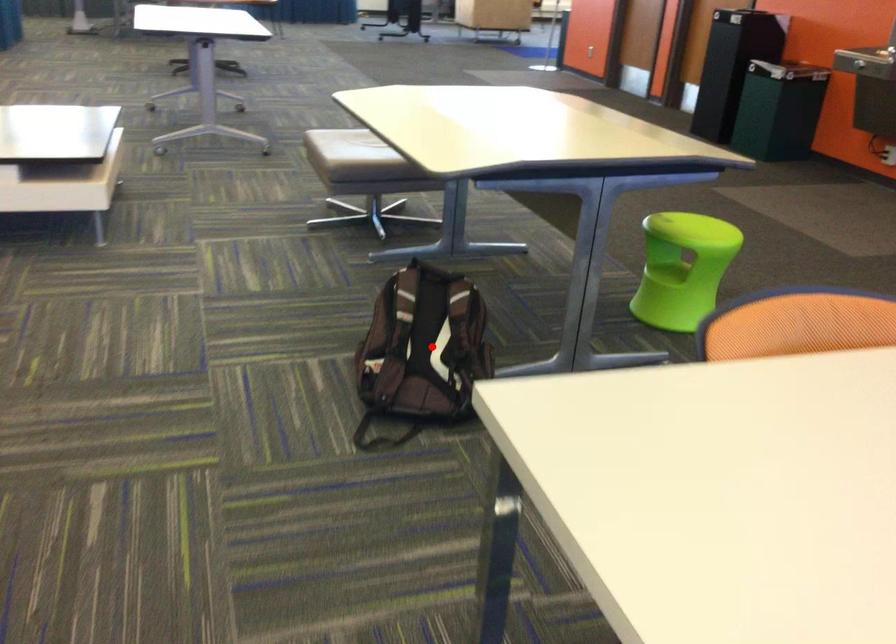
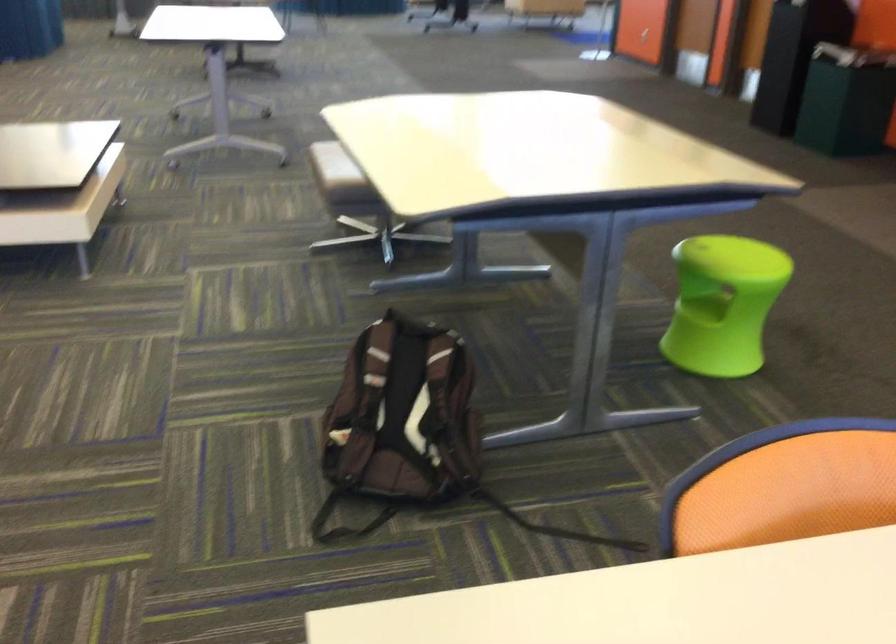
Question: I am providing you with two images of the same scene from different viewpoints. A red point is marked on the first image. At the location where the point appears in image 1, is it still visible in image 2?

Choices:
 (A) Yes
 (B) No

Answer: (A)